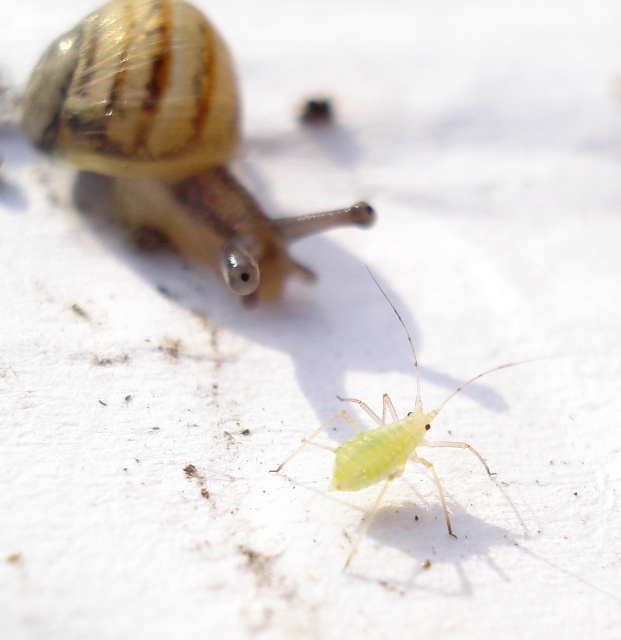
You are a scientist observing two insects on a white surface. You see the translucent brown snail at upper left and the green translucent aphid at center. Which insect is located to the left of the other?

The translucent brown snail at upper left is positioned on the left side of green translucent aphid at center.

You are a scientist observing two creatures on a white surface. You notice the translucent brown snail at upper left and the green translucent aphid at center. Which creature is closer to you?

The translucent brown snail at upper left is closer to you because the green translucent aphid at center is behind it.

You are an entomologist observing two insects on a white surface. You notice the translucent brown snail at upper left and the green translucent aphid at center. Which of these two insects is smaller?

The translucent brown snail at upper left is smaller than the green translucent aphid at center.